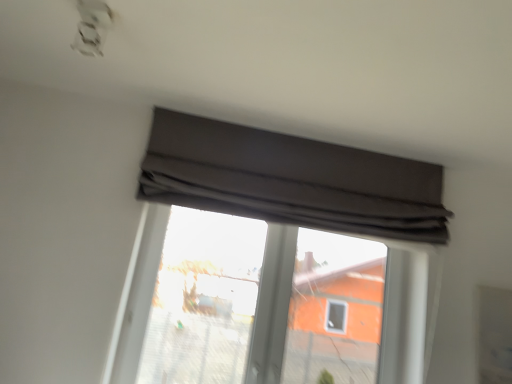
Question: From the image's perspective, is transparent glass window at center located above or below dark gray fabric at upper center?

Choices:
 (A) below
 (B) above

Answer: (A)

Question: Based on their sizes in the image, would you say transparent glass window at center is bigger or smaller than dark gray fabric at upper center?

Choices:
 (A) big
 (B) small

Answer: (B)

Question: Does point (347, 273) appear closer or farther from the camera than point (214, 173)?

Choices:
 (A) farther
 (B) closer

Answer: (A)

Question: From the image's perspective, is dark gray fabric at upper center above or below transparent glass window at center?

Choices:
 (A) above
 (B) below

Answer: (A)

Question: Considering the relative positions of dark gray fabric at upper center and transparent glass window at center in the image provided, is dark gray fabric at upper center to the left or to the right of transparent glass window at center?

Choices:
 (A) left
 (B) right

Answer: (B)

Question: Based on their sizes in the image, would you say dark gray fabric at upper center is bigger or smaller than transparent glass window at center?

Choices:
 (A) big
 (B) small

Answer: (A)

Question: Considering their positions, is dark gray fabric at upper center located in front of or behind transparent glass window at center?

Choices:
 (A) behind
 (B) front

Answer: (B)